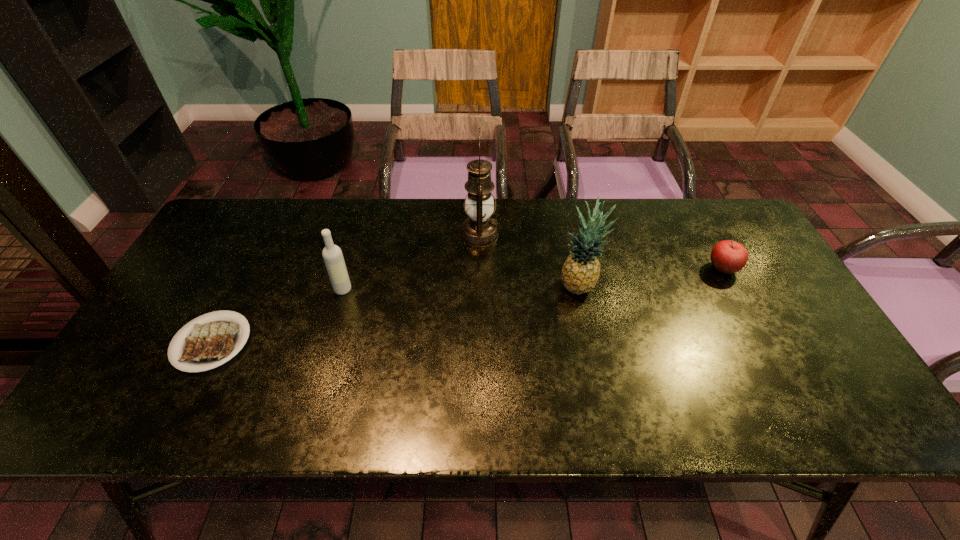
This screenshot has height=540, width=960. In the image, there is a desktop. What are the coordinates of `vacant space at the left edge` in the screenshot? It's located at (209, 281).

Locate an element on the screen. vacant space at the right edge of the desktop is located at coordinates (766, 317).

Where is `free space between the plate and the rightmost object`? The height and width of the screenshot is (540, 960). free space between the plate and the rightmost object is located at coordinates (467, 306).

Find the location of a particular element. free area in between the second shortest object and the leftmost object is located at coordinates (467, 306).

Find the location of a particular element. vacant point located between the fourth tallest object and the vodka is located at coordinates (533, 279).

At what (x,y) coordinates should I click in order to perform the action: click on vacant point located between the pineapple and the third shortest object. Please return your answer as a coordinate pair (x, y). The image size is (960, 540). Looking at the image, I should click on (461, 288).

Locate an element on the screen. This screenshot has width=960, height=540. free point between the plate and the pineapple is located at coordinates (396, 315).

Identify the location of free spot between the leftmost object and the second object from left to right. The width and height of the screenshot is (960, 540). (277, 316).

The width and height of the screenshot is (960, 540). I want to click on free space that is in between the shortest object and the rightmost object, so click(x=467, y=306).

Where is `empty space between the third shortest object and the pineapple`? The height and width of the screenshot is (540, 960). empty space between the third shortest object and the pineapple is located at coordinates (461, 288).